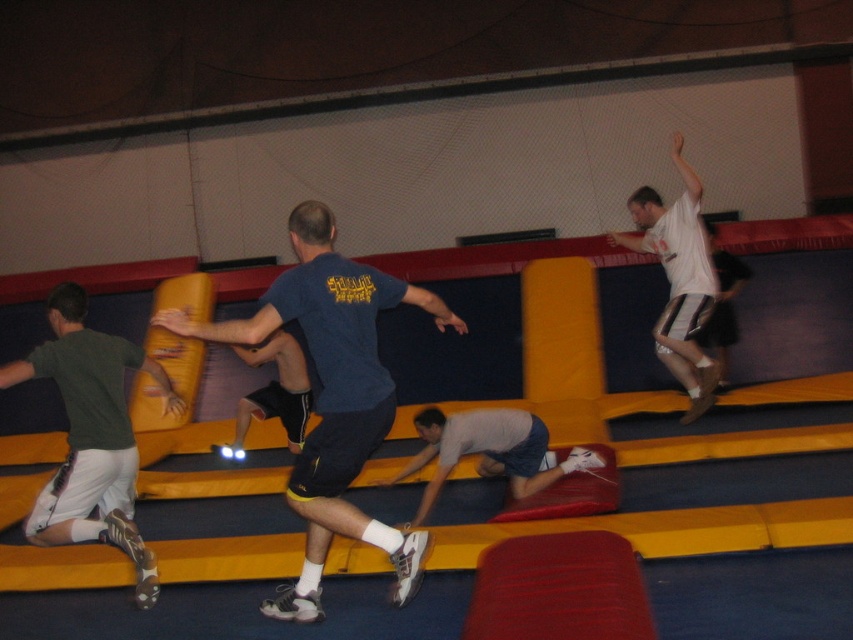
Question: Among these objects, which one is farthest from the camera?

Choices:
 (A) white matte shirt at upper right
 (B) dark green jersey at left
 (C) dark blue shorts at center
 (D) yellow foam obstacle at center

Answer: (D)

Question: Based on their relative distances, which object is farther from the light gray fabric shirt at center?

Choices:
 (A) dark green jersey at left
 (B) white matte shirt at upper right

Answer: (B)

Question: Can you confirm if yellow foam obstacle at center is positioned to the left of dark blue t-shirt at center?

Choices:
 (A) yes
 (B) no

Answer: (B)

Question: Is the position of yellow foam obstacle at center less distant than that of dark blue shorts at center?

Choices:
 (A) no
 (B) yes

Answer: (A)

Question: Which object is positioned closest to the dark blue t-shirt at center?

Choices:
 (A) light gray fabric shirt at center
 (B) dark blue shorts at center

Answer: (A)

Question: Does yellow foam obstacle at center appear over white matte shirt at upper right?

Choices:
 (A) no
 (B) yes

Answer: (A)